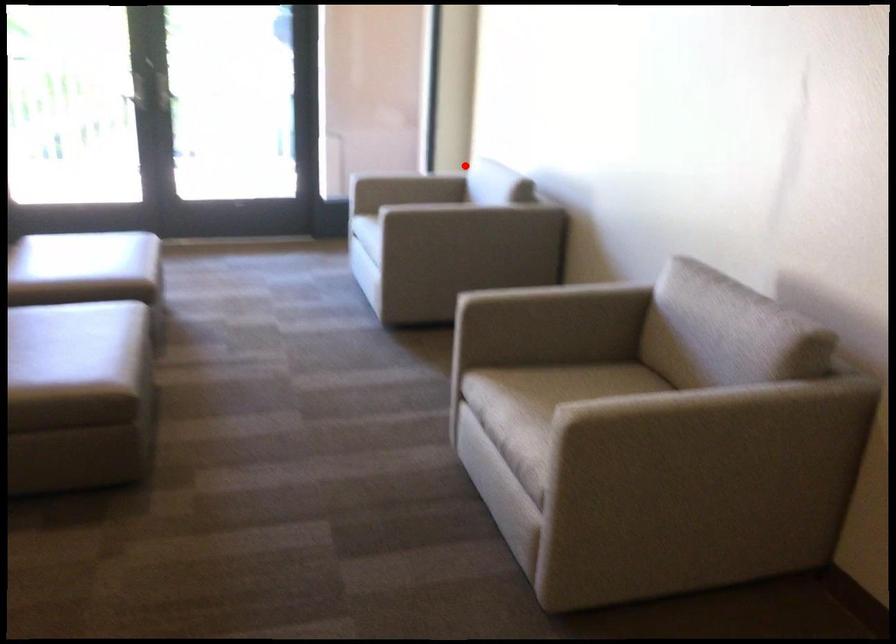
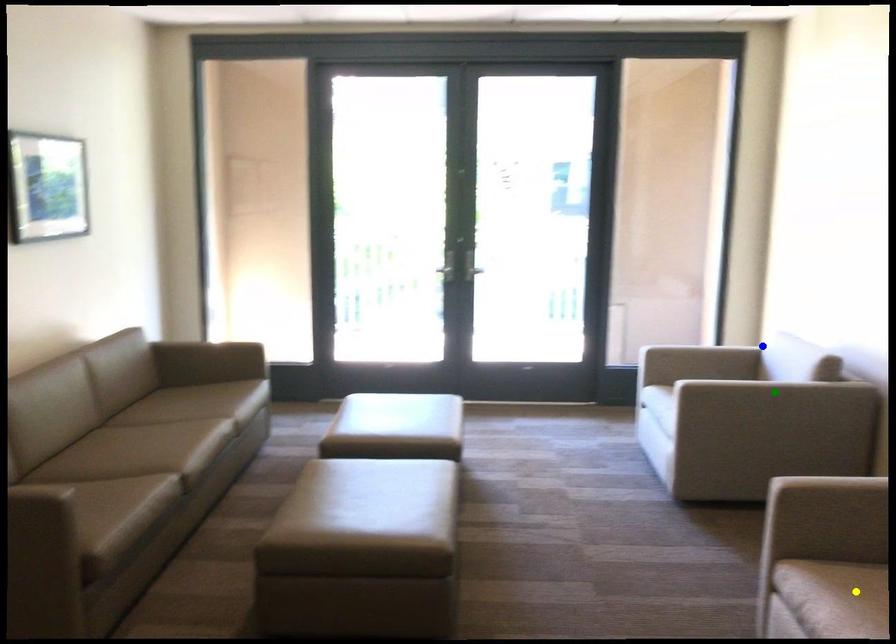
Question: I am providing you with two images of the same scene from different viewpoints. A red point is marked on the first image. You are given multiple points on the second image. Can you choose the point in image 2 that corresponds to the point in image 1?

Choices:
 (A) yellow point
 (B) green point
 (C) blue point

Answer: (C)